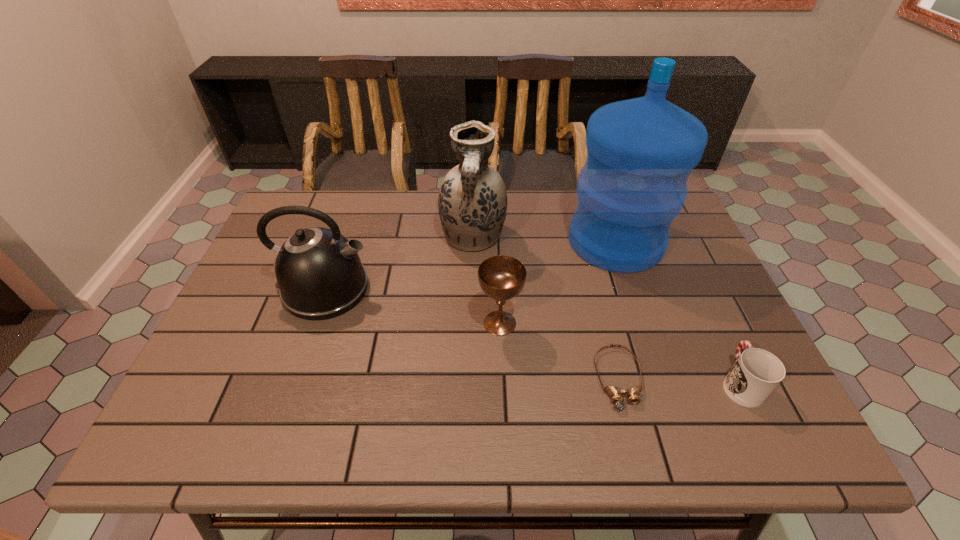
This screenshot has width=960, height=540. Find the location of `free space located on the right of the fourth tallest object`. free space located on the right of the fourth tallest object is located at coordinates tap(579, 323).

You are a GUI agent. You are given a task and a screenshot of the screen. Output one action in this format:
    pyautogui.click(x=<x>, y=<y>)
    Task: Click on the free space located 0.350m on the side of the cup where the handle is located
    
    Given the screenshot: What is the action you would take?
    coord(680,256)

The height and width of the screenshot is (540, 960). I want to click on free space located on the side of the cup where the handle is located, so click(697, 293).

Identify the location of vacant position located 0.250m on the side of the cup where the handle is located. (692, 282).

Find the location of `free region located 0.070m on the front lenses and sides of the goggles`. free region located 0.070m on the front lenses and sides of the goggles is located at coordinates (636, 447).

Find the location of a particular element. The width and height of the screenshot is (960, 540). water jug located in the far edge section of the desktop is located at coordinates (641, 151).

What are the coordinates of `vase positioned at the far edge` in the screenshot? It's located at (472, 201).

Where is `object that is at the near edge`? object that is at the near edge is located at coordinates (616, 394).

At what (x,y) coordinates should I click in order to perform the action: click on object that is at the left edge. Please return your answer as a coordinate pair (x, y). The image size is (960, 540). Looking at the image, I should click on (319, 273).

Where is `water jug that is at the right edge`? water jug that is at the right edge is located at coordinates (641, 151).